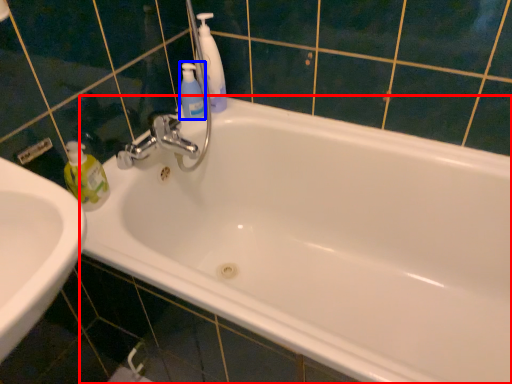
Question: Which object is closer to the camera taking this photo, bathtub (highlighted by a red box) or mouthwash (highlighted by a blue box)?

Choices:
 (A) bathtub
 (B) mouthwash

Answer: (A)